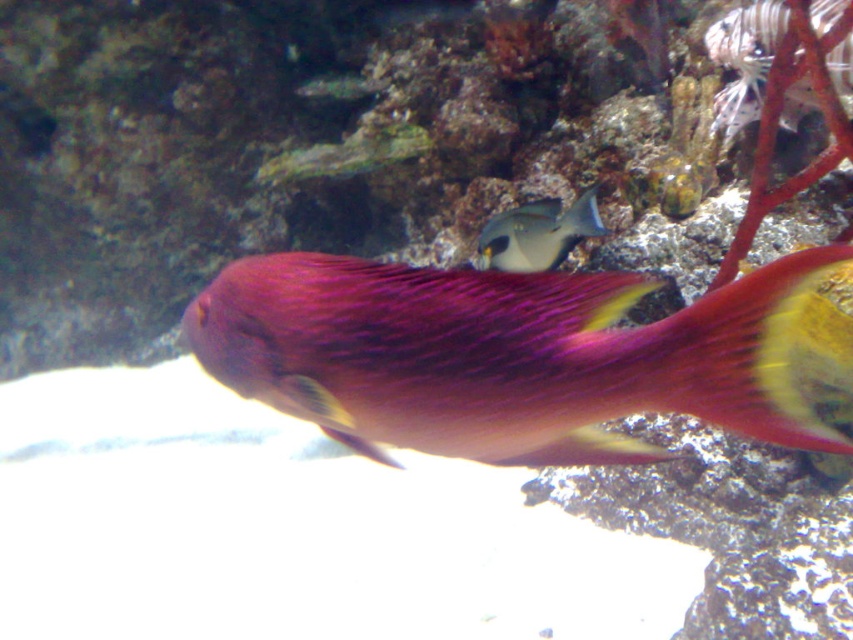
You are an underwater photographer aiming to capture a clear photo of the shiny pink fish at center. However, the gray matte fish at center is blocking your view. Can you adjust your camera angle to take the photo without moving either fish?

The shiny pink fish at center is positioned under the gray matte fish at center, so you can tilt your camera downward to capture the shiny pink fish at center from below, avoiding the obstruction caused by the gray matte fish at center.